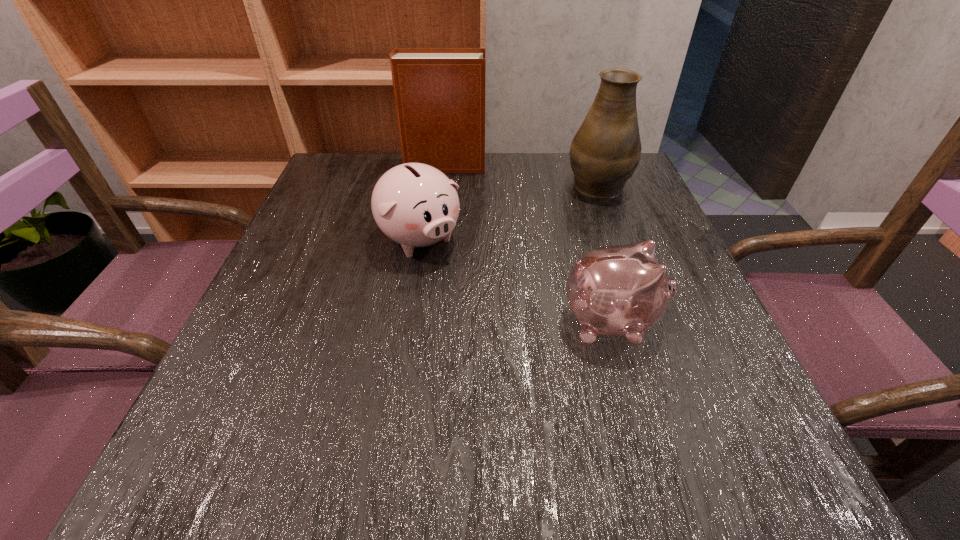
Where is `hardback book`? Image resolution: width=960 pixels, height=540 pixels. hardback book is located at coordinates (439, 93).

Find the location of a particular element. This screenshot has height=540, width=960. pitcher is located at coordinates (605, 152).

At what (x,y) coordinates should I click in order to perform the action: click on the third farthest object. Please return your answer as a coordinate pair (x, y). This screenshot has width=960, height=540. Looking at the image, I should click on (416, 205).

At what (x,y) coordinates should I click in order to perform the action: click on the left piggy bank. Please return your answer as a coordinate pair (x, y). This screenshot has height=540, width=960. Looking at the image, I should click on (416, 205).

Locate an element on the screen. The image size is (960, 540). the right piggy bank is located at coordinates (622, 290).

Where is `the nearest object`? the nearest object is located at coordinates (622, 290).

The height and width of the screenshot is (540, 960). Identify the location of free region located on the open cover of the hardback book. (579, 166).

Image resolution: width=960 pixels, height=540 pixels. Find the location of `vacant space located 0.330m on the right of the left piggy bank`. vacant space located 0.330m on the right of the left piggy bank is located at coordinates (622, 239).

The image size is (960, 540). In order to click on hardback book located at the far edge in this screenshot , I will do `click(439, 93)`.

This screenshot has width=960, height=540. Identify the location of pitcher located in the far edge section of the desktop. (605, 152).